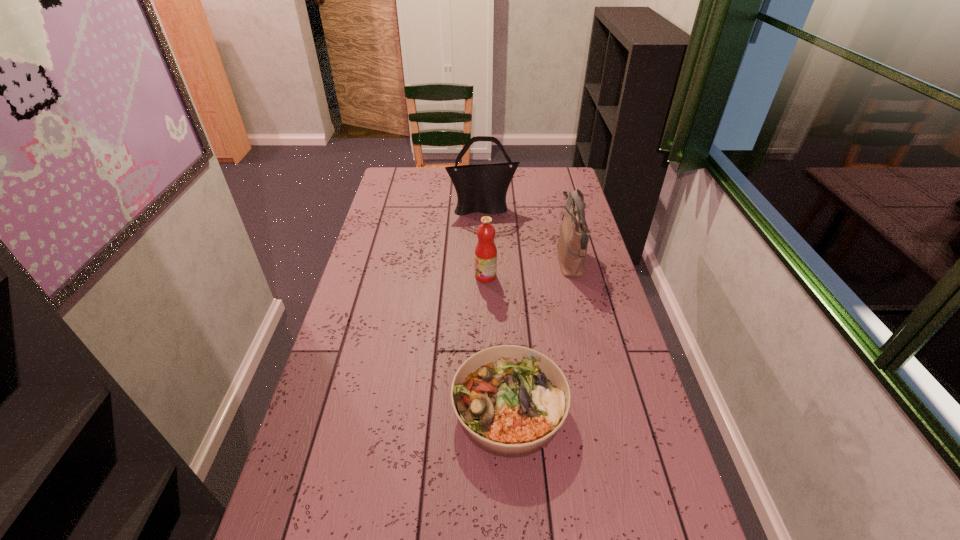
What are the coordinates of `the farther shoulder bag` in the screenshot? It's located at (482, 188).

Locate an element on the screen. The image size is (960, 540). the farthest object is located at coordinates (482, 188).

This screenshot has width=960, height=540. Find the location of `the right shoulder bag`. the right shoulder bag is located at coordinates (572, 244).

Image resolution: width=960 pixels, height=540 pixels. Identify the location of the nearer shoulder bag. coord(572,244).

You are a GUI agent. You are given a task and a screenshot of the screen. Output one action in this format:
    pyautogui.click(x=<x>, y=<y>)
    Task: Click on the second shortest object
    The height and width of the screenshot is (540, 960).
    Given the screenshot: What is the action you would take?
    pyautogui.click(x=485, y=252)

This screenshot has width=960, height=540. Identify the location of the shortest object. (511, 400).

Where is `the nearest object`? The height and width of the screenshot is (540, 960). the nearest object is located at coordinates (511, 400).

Locate an element on the screen. The height and width of the screenshot is (540, 960). vacant space situated on the left of the left shoulder bag is located at coordinates (422, 208).

The height and width of the screenshot is (540, 960). I want to click on free space located on the front-facing side of the right shoulder bag, so click(x=502, y=261).

Locate an element on the screen. This screenshot has width=960, height=540. free space located on the front-facing side of the right shoulder bag is located at coordinates (504, 261).